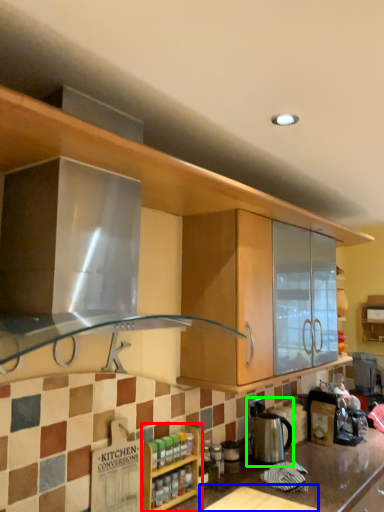
Question: Based on their relative distances, which object is farther from cabinetry (highlighted by a red box)? Choose from table (highlighted by a blue box) and appliance (highlighted by a green box).

Choices:
 (A) table
 (B) appliance

Answer: (B)